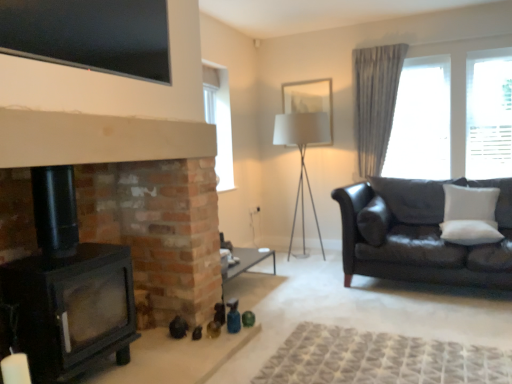
Question: Is sheer fabric curtain at right beside black glass tv at upper center?

Choices:
 (A) yes
 (B) no

Answer: (B)

Question: Does sheer fabric curtain at right have a greater width compared to black glass tv at upper center?

Choices:
 (A) yes
 (B) no

Answer: (A)

Question: Is sheer fabric curtain at right far away from black glass tv at upper center?

Choices:
 (A) no
 (B) yes

Answer: (B)

Question: Is sheer fabric curtain at right turned away from black glass tv at upper center?

Choices:
 (A) yes
 (B) no

Answer: (B)

Question: Is sheer fabric curtain at right positioned before black glass tv at upper center?

Choices:
 (A) yes
 (B) no

Answer: (B)

Question: From the image's perspective, is white fabric picture frame at upper center above or below black glass tv at upper center?

Choices:
 (A) above
 (B) below

Answer: (A)

Question: Based on their positions, is white fabric picture frame at upper center located to the left or right of black glass tv at upper center?

Choices:
 (A) right
 (B) left

Answer: (A)

Question: Is point (287, 87) closer or farther from the camera than point (117, 4)?

Choices:
 (A) closer
 (B) farther

Answer: (B)

Question: In terms of width, does white fabric picture frame at upper center look wider or thinner when compared to black glass tv at upper center?

Choices:
 (A) thin
 (B) wide

Answer: (B)

Question: From a real-world perspective, is white fabric lampshade at center physically located above or below gray fabric curtain at upper right?

Choices:
 (A) above
 (B) below

Answer: (B)

Question: Considering the positions of point (295, 117) and point (388, 99), is point (295, 117) closer or farther from the camera than point (388, 99)?

Choices:
 (A) farther
 (B) closer

Answer: (B)

Question: Considering the positions of white fabric lampshade at center and gray fabric curtain at upper right in the image, is white fabric lampshade at center wider or thinner than gray fabric curtain at upper right?

Choices:
 (A) wide
 (B) thin

Answer: (A)

Question: From the image's perspective, relative to gray fabric curtain at upper right, is white fabric lampshade at center above or below?

Choices:
 (A) below
 (B) above

Answer: (A)

Question: In terms of height, does white fabric picture frame at upper center look taller or shorter compared to gray fabric curtain at upper right?

Choices:
 (A) short
 (B) tall

Answer: (A)

Question: Is point (320, 104) positioned closer to the camera than point (377, 125)?

Choices:
 (A) closer
 (B) farther

Answer: (B)